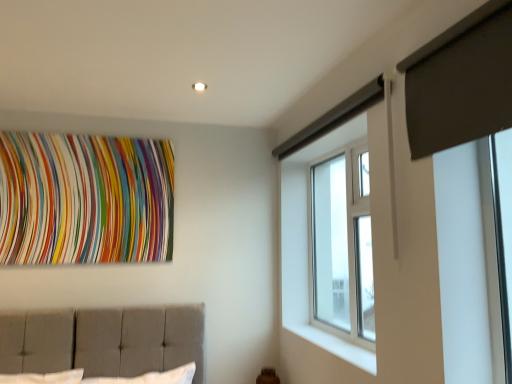
Where is `blank space situated above multicolored fabric at upper left (from a real-world perspective)`? The image size is (512, 384). blank space situated above multicolored fabric at upper left (from a real-world perspective) is located at coordinates (87, 129).